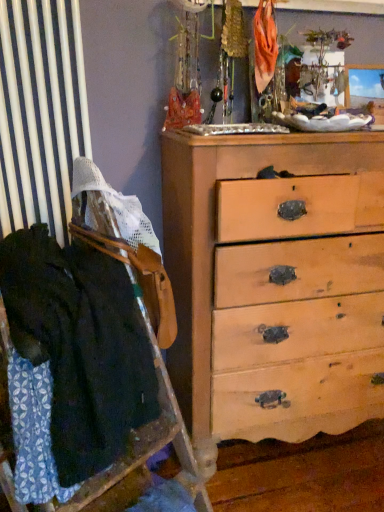
Question: Is point (306, 437) positioned closer to the camera than point (46, 350)?

Choices:
 (A) closer
 (B) farther

Answer: (B)

Question: Based on their positions, is light brown wooden chest of drawers at center located to the left or right of dark blue fabric at left?

Choices:
 (A) left
 (B) right

Answer: (B)

Question: Considering their positions, is light brown wooden chest of drawers at center located in front of or behind dark blue fabric at left?

Choices:
 (A) behind
 (B) front

Answer: (A)

Question: From a real-world perspective, relative to light brown wooden chest of drawers at center, is dark blue fabric at left vertically above or below?

Choices:
 (A) above
 (B) below

Answer: (A)

Question: Is dark blue fabric at left spatially inside light brown wooden chest of drawers at center, or outside of it?

Choices:
 (A) inside
 (B) outside

Answer: (B)

Question: Is dark blue fabric at left bigger or smaller than light brown wooden chest of drawers at center?

Choices:
 (A) big
 (B) small

Answer: (B)

Question: Does point (21, 249) appear closer or farther from the camera than point (367, 361)?

Choices:
 (A) closer
 (B) farther

Answer: (A)